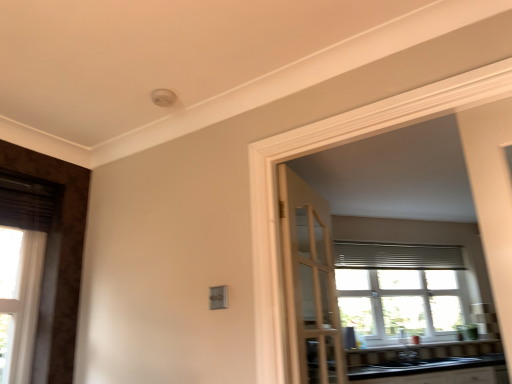
Question: From the image's perspective, relative to light wood door at center, acting as the 1th door starting from the right, is white glass window at center above or below?

Choices:
 (A) above
 (B) below

Answer: (B)

Question: Would you say white glass window at center is to the left or to the right of light wood door at center, acting as the 1th door starting from the right, in the picture?

Choices:
 (A) left
 (B) right

Answer: (B)

Question: Based on their relative distances, which object is nearer to the black glossy sink at lower center, which is the 2th sink in left-to-right order?

Choices:
 (A) white glass window at center
 (B) white glossy window sill at lower center
 (C) white wood door at left, which appears as the 2th door when viewed from the right
 (D) light wood door at center, positioned as the second door in left-to-right order
 (E) black glossy sink at lower right, acting as the first sink starting from the left

Answer: (E)

Question: Estimate the real-world distances between objects in this image. Which object is closer to the white wood door at left, which appears as the first door when viewed from the left?

Choices:
 (A) white glossy window sill at lower center
 (B) silver metallic blinds at upper center
 (C) black glossy sink at lower right, acting as the first sink starting from the left
 (D) black glossy sink at lower center, the first sink positioned from the right
 (E) light wood door at center, acting as the 1th door starting from the right

Answer: (E)